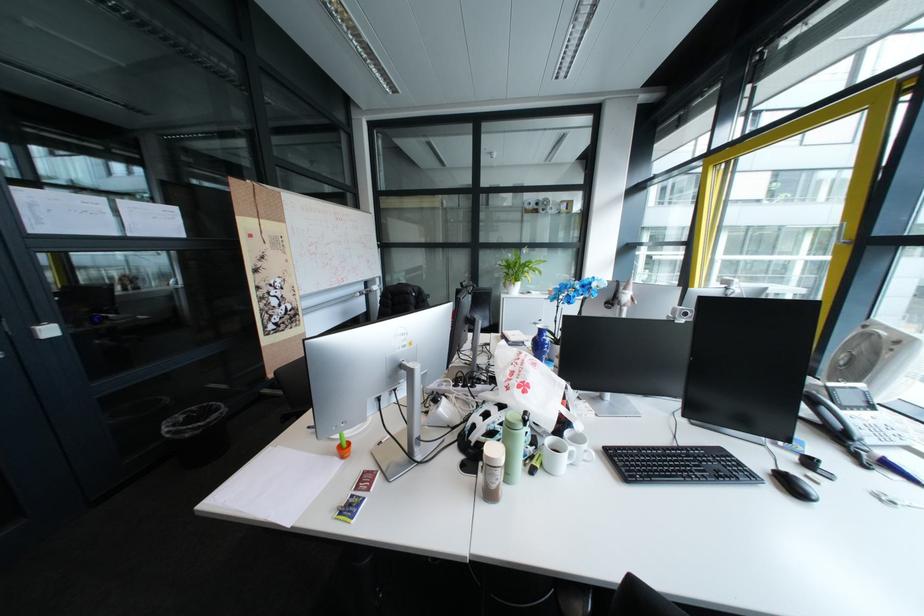
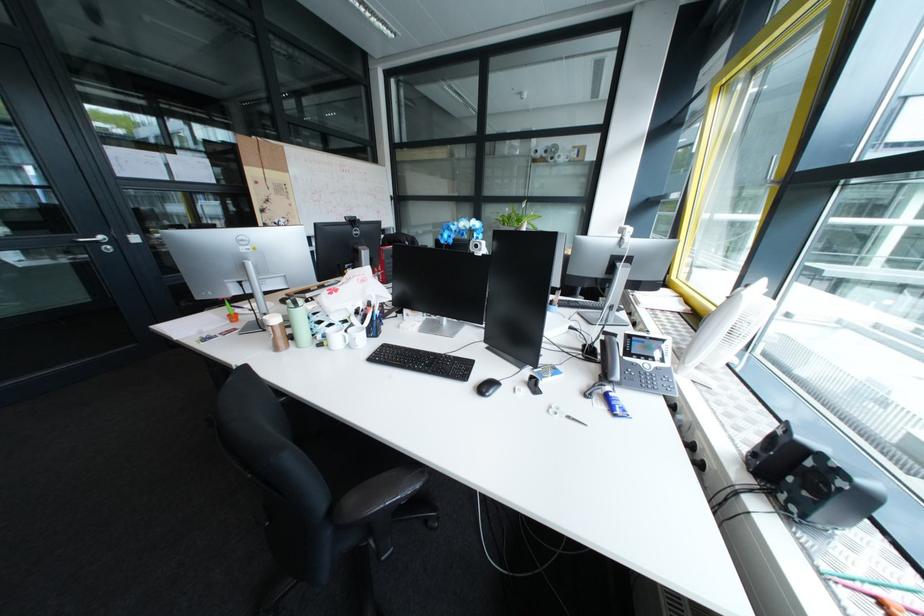
Find the pixel in the second image that matches pixel 507 484 in the first image.

(284, 338)